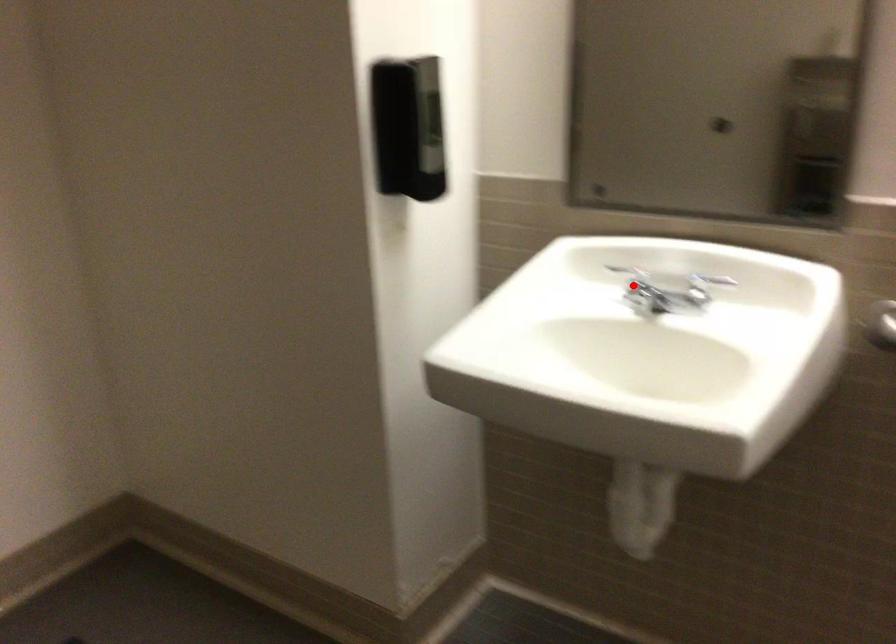
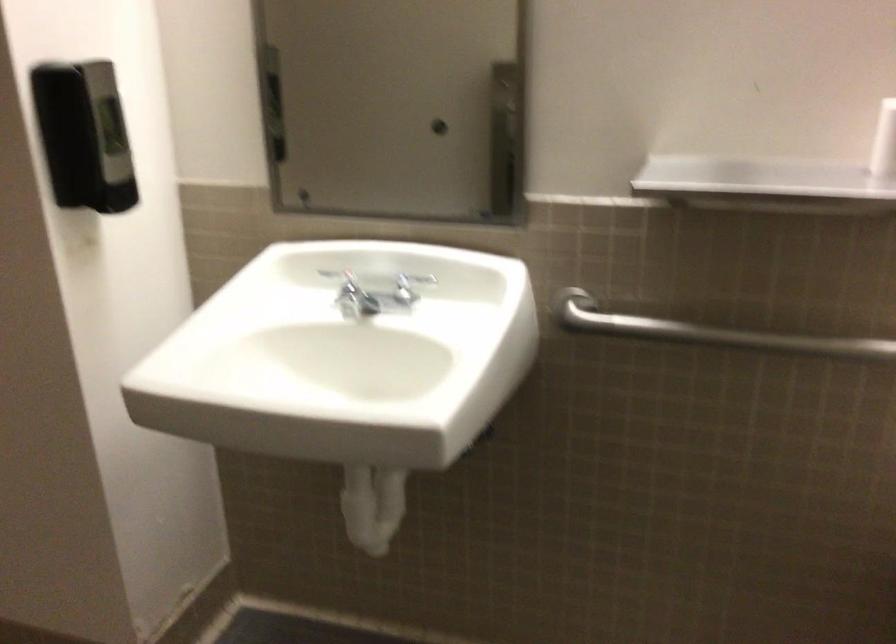
Find the pixel in the second image that matches the highlighted location in the first image.

(346, 290)